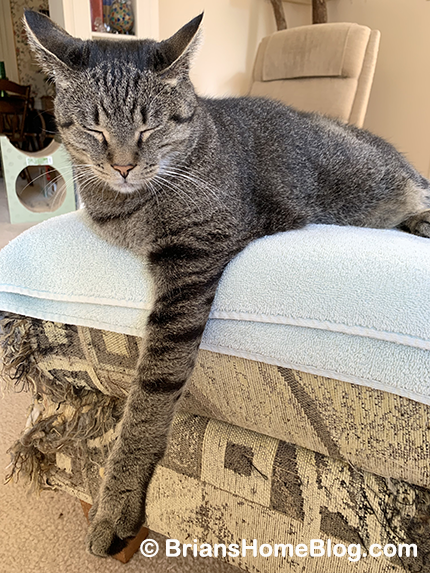
Identify the location of wall. The image size is (430, 573). (396, 31).